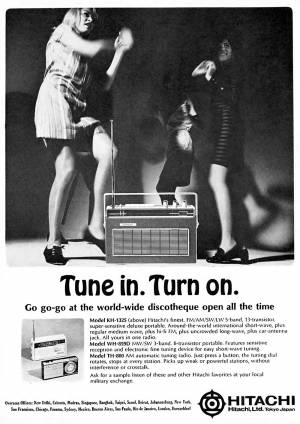
What are the coordinates of `knob` in the screenshot? It's located at point(165,202), point(173,203), point(183,202).